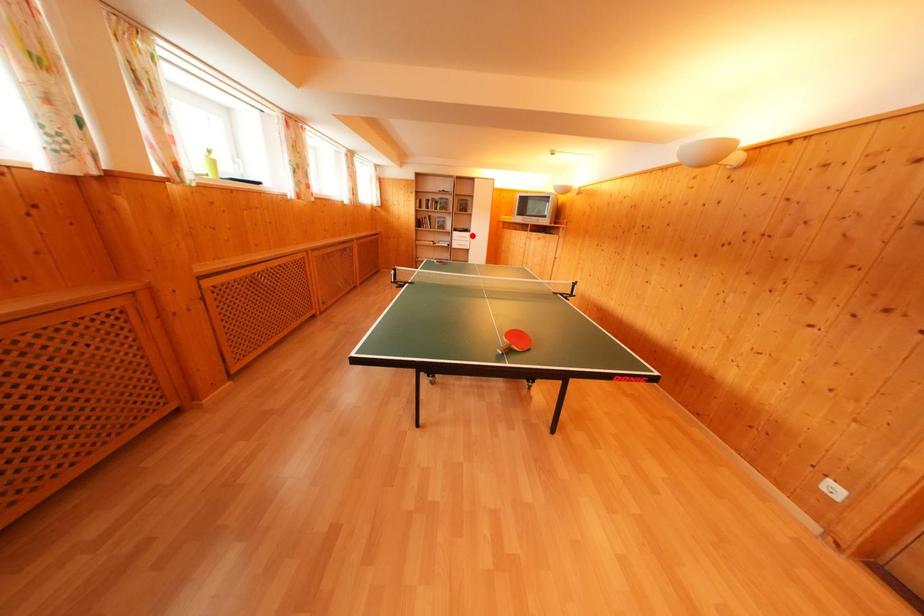
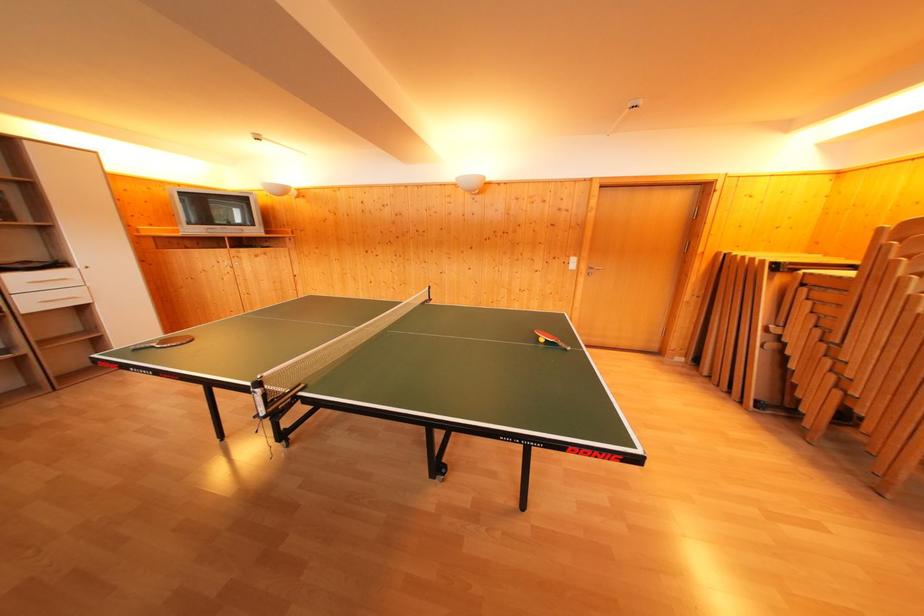
The point at the highlighted location is marked in the first image. Where is the corresponding point in the second image?

(64, 270)